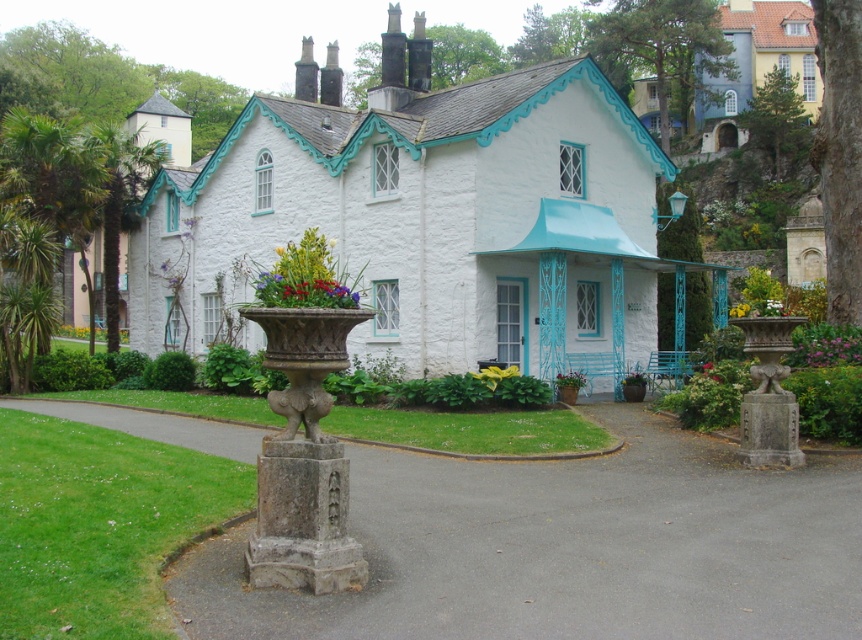
Question: Does white fabric flower at center appear on the right side of green matte flower at center?

Choices:
 (A) no
 (B) yes

Answer: (A)

Question: Does vibrant floral bouquet at center lie in front of yellow fabric flower at center?

Choices:
 (A) no
 (B) yes

Answer: (B)

Question: Estimate the real-world distances between objects in this image. Which object is closer to the gray asphalt driveway at lower center?

Choices:
 (A) vibrant floral bouquet at center
 (B) green matte flower at center
 (C) white fabric flower at center

Answer: (A)

Question: Which point is farther to the camera?

Choices:
 (A) (773, 305)
 (B) (529, 476)

Answer: (A)

Question: Which is farther from the yellow fabric flower at center?

Choices:
 (A) white fabric flower at center
 (B) gray asphalt driveway at lower center
 (C) vibrant floral bouquet at center

Answer: (A)

Question: Is yellow fabric flower at center above green matte flower at center?

Choices:
 (A) no
 (B) yes

Answer: (B)